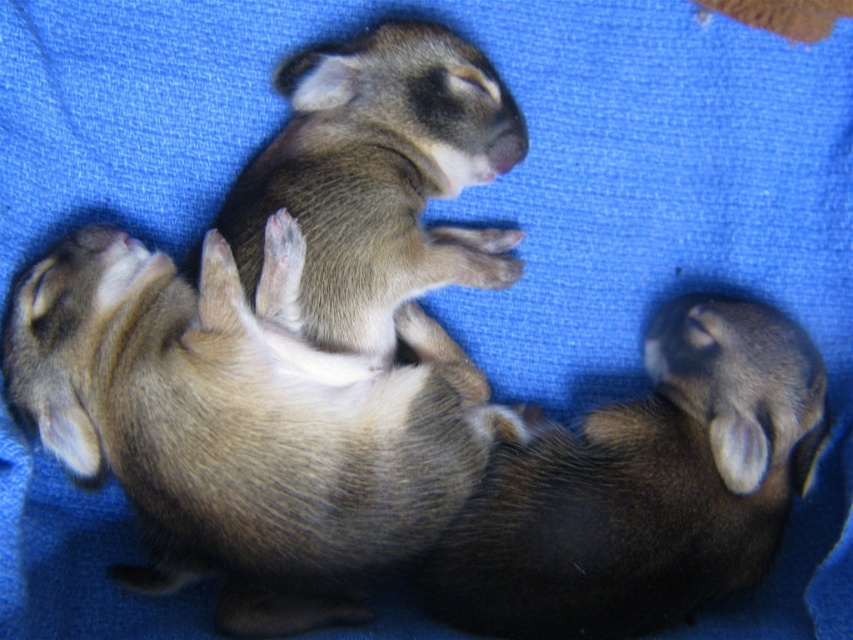
Question: Which point is farther to the camera?

Choices:
 (A) fuzzy brown puppy at center
 (B) brown fuzzy rabbit at lower right

Answer: (A)

Question: Is brown fuzzy puppy at center bigger than fuzzy brown puppy at center?

Choices:
 (A) yes
 (B) no

Answer: (A)

Question: Does brown fuzzy puppy at center appear on the right side of brown fuzzy rabbit at lower right?

Choices:
 (A) no
 (B) yes

Answer: (A)

Question: Which of these objects is positioned farthest from the fuzzy brown puppy at center?

Choices:
 (A) brown fuzzy puppy at center
 (B) brown fuzzy rabbit at lower right

Answer: (B)

Question: Which of the following is the closest to the observer?

Choices:
 (A) fuzzy brown puppy at center
 (B) brown fuzzy rabbit at lower right

Answer: (B)

Question: Is brown fuzzy puppy at center positioned at the back of brown fuzzy rabbit at lower right?

Choices:
 (A) yes
 (B) no

Answer: (B)